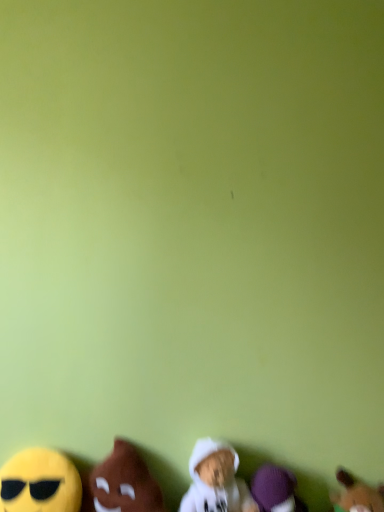
Question: Is brown plush toy at lower right, the fifth toy in the left-to-right sequence, bigger or smaller than white plush toy at lower center, which is the third toy from right to left?

Choices:
 (A) small
 (B) big

Answer: (A)

Question: Does point (342, 503) appear closer or farther from the camera than point (226, 472)?

Choices:
 (A) farther
 (B) closer

Answer: (A)

Question: Which object is the farthest from the yellow plush toy at lower left, positioned as the 1th toy in left-to-right order?

Choices:
 (A) purple plush toy at lower right, which is counted as the 4th toy, starting from the left
 (B) white plush toy at lower center, positioned as the 3th toy in left-to-right order
 (C) brown plush toy at lower right, positioned as the 1th toy in right-to-left order
 (D) brown plush toy at lower left, acting as the 4th toy starting from the right

Answer: (C)

Question: Which is nearer to the white plush toy at lower center, which is the third toy from right to left?

Choices:
 (A) brown plush toy at lower right, the fifth toy in the left-to-right sequence
 (B) brown plush toy at lower left, the second toy viewed from the left
 (C) purple plush toy at lower right, which is counted as the 4th toy, starting from the left
 (D) yellow plush toy at lower left, positioned as the 1th toy in left-to-right order

Answer: (C)